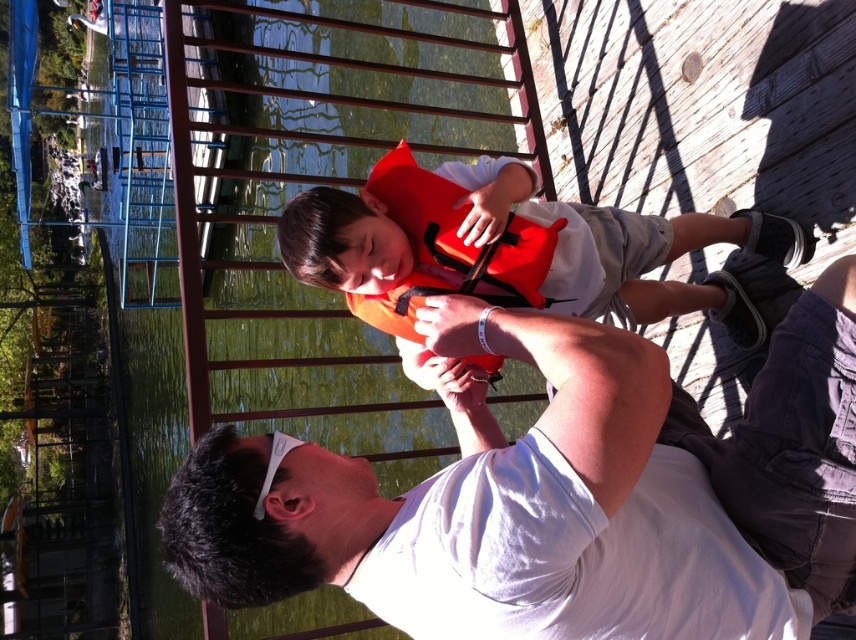
Is point (817, 490) behind point (551, 221)?

No, (817, 490) is closer to viewer.

Measure the distance between white matte shirt at center and orange matte life jacket at center.

white matte shirt at center is 30.49 inches from orange matte life jacket at center.

Is point (498, 340) positioned in front of point (432, 209)?

That is True.

Where is `white matte shirt at center`? white matte shirt at center is located at coordinates (732, 429).

Does white matte shirt at center lie in front of orange life vest at center?

Yes, it is in front of orange life vest at center.

Between white matte shirt at center and orange life vest at center, which one has more height?

white matte shirt at center is taller.

The width and height of the screenshot is (856, 640). I want to click on white matte shirt at center, so [732, 429].

Does orange life vest at center have a lesser height compared to orange matte life jacket at center?

Yes, orange life vest at center is shorter than orange matte life jacket at center.

Does orange life vest at center have a greater height compared to orange matte life jacket at center?

No, orange life vest at center is not taller than orange matte life jacket at center.

Does point (700, 241) come farther from viewer compared to point (400, 154)?

Yes, point (700, 241) is behind point (400, 154).

This screenshot has height=640, width=856. In order to click on orange life vest at center in this screenshot , I will do `click(510, 248)`.